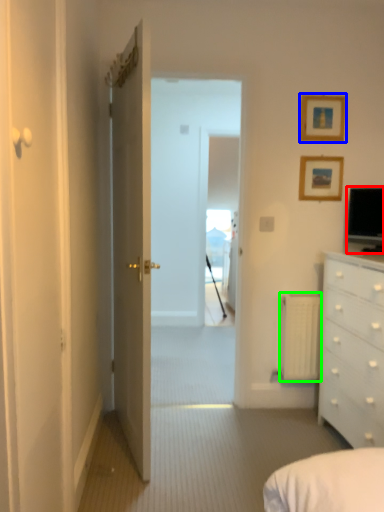
Question: Based on their relative distances, which object is nearer to television (highlighted by a red box)? Choose from picture frame (highlighted by a blue box) and radiator (highlighted by a green box).

Choices:
 (A) picture frame
 (B) radiator

Answer: (A)